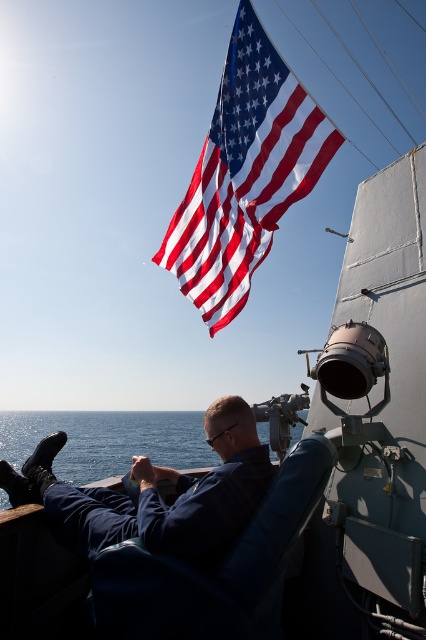
Question: Does blue fabric chair at center appear under blue water at lower left?

Choices:
 (A) yes
 (B) no

Answer: (B)

Question: Which object is the farthest from the blue water at lower left?

Choices:
 (A) red-white striped fabric flag at upper center
 (B) blue fabric chair at center

Answer: (A)

Question: Which point is farther from the camera taking this photo?

Choices:
 (A) (273, 451)
 (B) (278, 113)
 (C) (279, 600)

Answer: (A)

Question: In this image, where is red-white striped fabric flag at upper center located relative to blue water at lower left?

Choices:
 (A) right
 (B) left

Answer: (A)

Question: Can you confirm if red-white striped fabric flag at upper center is positioned below blue water at lower left?

Choices:
 (A) yes
 (B) no

Answer: (B)

Question: Which of the following is the farthest from the observer?

Choices:
 (A) (146, 451)
 (B) (199, 172)
 (C) (250, 604)

Answer: (A)